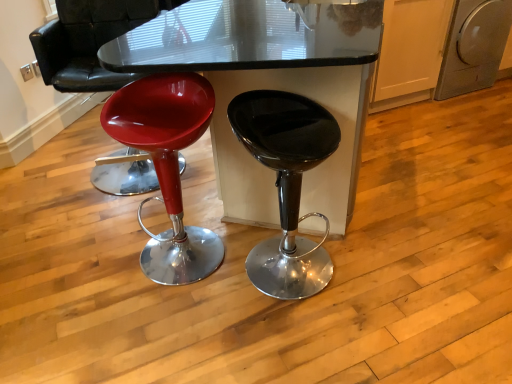
Where is `free spot in front of glossy black stool at center, arranged as the 2th stool when viewed from the left`? free spot in front of glossy black stool at center, arranged as the 2th stool when viewed from the left is located at coordinates (298, 348).